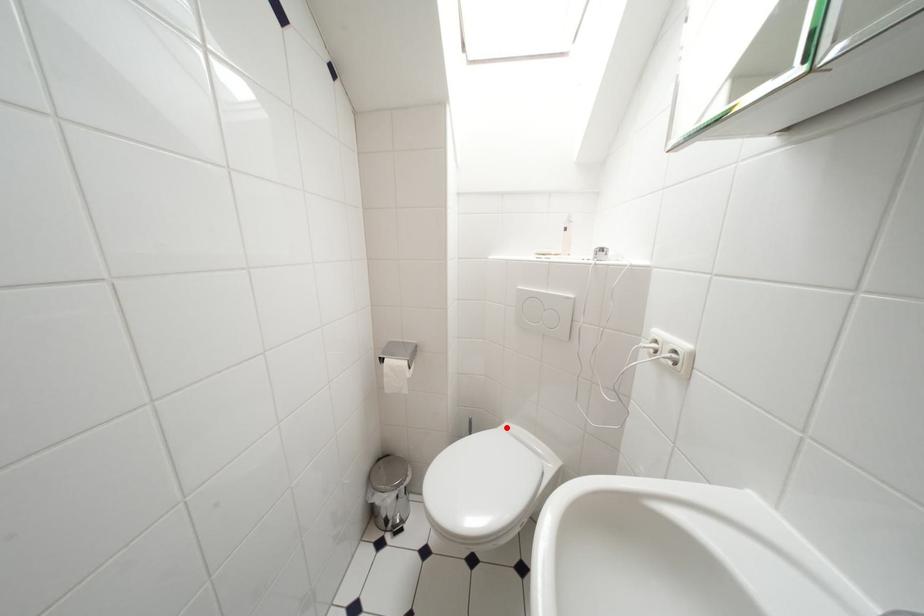
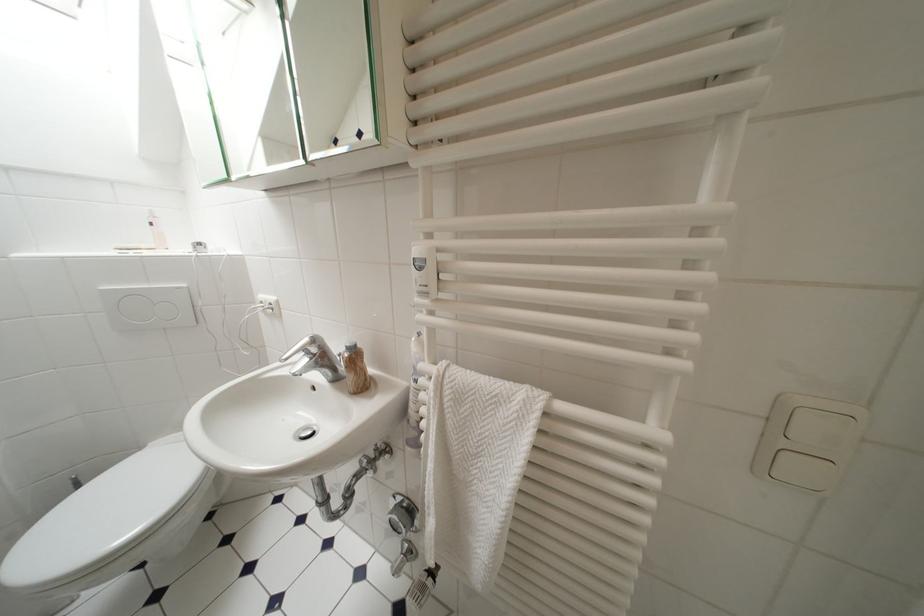
Locate, in the second image, the point that corresponds to the highlighted location in the first image.

(148, 451)